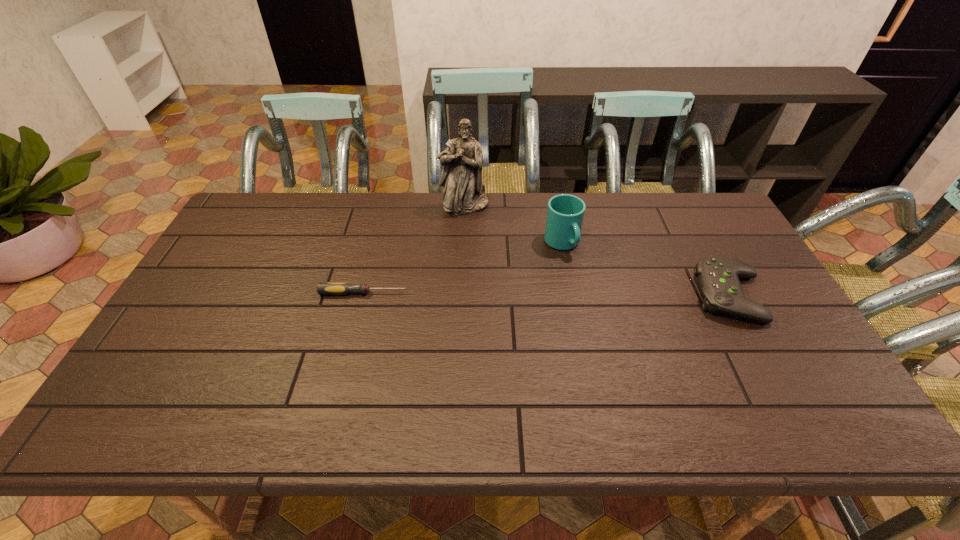
Find the location of a particular element. Image resolution: width=960 pixels, height=540 pixels. vacant space on the desktop that is between the screwdriver and the second shortest object and is positioned on the handle side of the third object from left to right is located at coordinates (600, 294).

Find the location of a particular element. free space on the desktop that is between the screwdriver and the rightmost object and is positioned on the front-facing side of the second object from left to right is located at coordinates (510, 294).